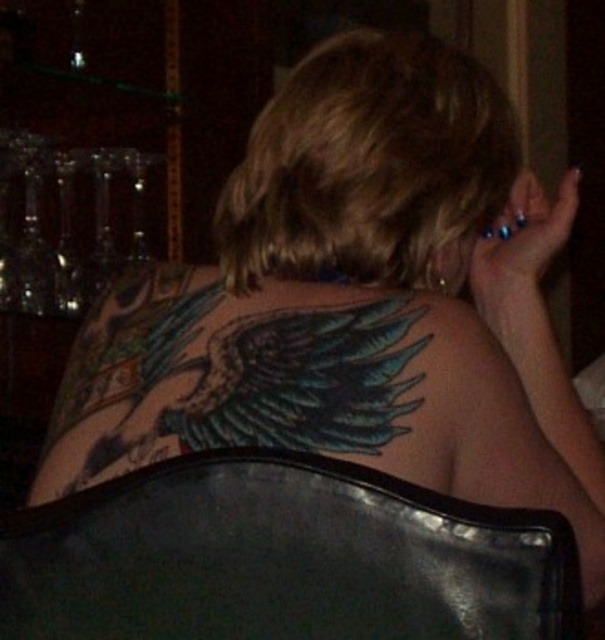
Is black leather chair at lower center to the left of colorful ink wings at upper back from the viewer's perspective?

Incorrect, black leather chair at lower center is not on the left side of colorful ink wings at upper back.

Is point (122, 547) closer to viewer compared to point (229, 340)?

Yes, it is.

Find the location of a particular element. black leather chair at lower center is located at coordinates (281, 557).